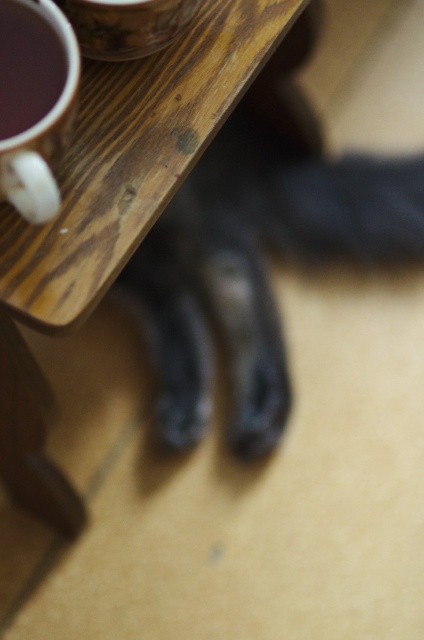
You are a delivery robot that needs to place a small package on the wooden table at upper center. The package is 10 inches long. Can you safely place it on the table without it overlapping the matte ceramic cup at upper left?

The wooden table at upper center is 11.04 inches away from the matte ceramic cup at upper left. Since the package is only 10 inches long, it can be placed on the table without overlapping the cup as there is enough space between them.

You are organizing items on a desk and need to place a new object between the wooden table at upper center and the matte ceramic cup at upper left. Can you fit it there?

The matte ceramic cup at upper left is behind the wooden table at upper center, so there is no space between them for placing a new object.

You are looking at the image and want to place a small decorative item on the wooden table at upper center. Based on the scene description, where exactly should you place it?

The wooden table at upper center is located at the coordinates point (113, 211), so you should place the decorative item there.